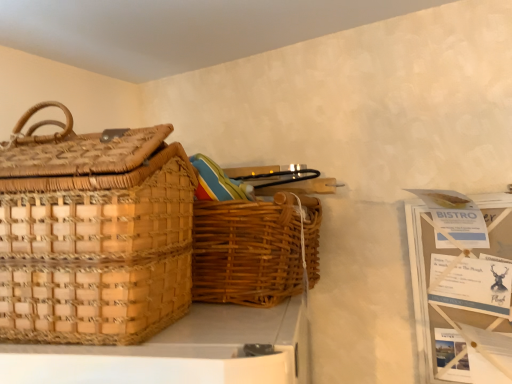
Question: Which direction should I rotate to face woven brown picnic basket at center, arranged as the 2th picnic basket when viewed from the left, — up or down?

Choices:
 (A) down
 (B) up

Answer: (A)

Question: Could you tell me if woven brown picnic basket at center, arranged as the 2th picnic basket when viewed from the left, is turned towards woven natural picnic basket at left, which is the 1th picnic basket from left to right?

Choices:
 (A) no
 (B) yes

Answer: (B)

Question: Does woven brown picnic basket at center, marked as the 1th picnic basket in a right-to-left arrangement, have a smaller size compared to woven natural picnic basket at left, which is the 1th picnic basket from left to right?

Choices:
 (A) yes
 (B) no

Answer: (A)

Question: Does woven brown picnic basket at center, marked as the 1th picnic basket in a right-to-left arrangement, lie in front of woven natural picnic basket at left, the second picnic basket when ordered from right to left?

Choices:
 (A) yes
 (B) no

Answer: (B)

Question: Can you see woven brown picnic basket at center, marked as the 1th picnic basket in a right-to-left arrangement, touching woven natural picnic basket at left, the second picnic basket when ordered from right to left?

Choices:
 (A) no
 (B) yes

Answer: (A)

Question: From the image's perspective, would you say woven brown picnic basket at center, marked as the 1th picnic basket in a right-to-left arrangement, is positioned over woven natural picnic basket at left, the second picnic basket when ordered from right to left?

Choices:
 (A) yes
 (B) no

Answer: (B)

Question: Is woven brown picnic basket at center, arranged as the 2th picnic basket when viewed from the left, positioned behind woven natural picnic basket at left, which is the 1th picnic basket from left to right?

Choices:
 (A) yes
 (B) no

Answer: (A)

Question: From a real-world perspective, is woven natural picnic basket at left, which is the 1th picnic basket from left to right, positioned over woven brown picnic basket at center, marked as the 1th picnic basket in a right-to-left arrangement, based on gravity?

Choices:
 (A) yes
 (B) no

Answer: (A)

Question: Could you tell me if woven natural picnic basket at left, the second picnic basket when ordered from right to left, is facing woven brown picnic basket at center, marked as the 1th picnic basket in a right-to-left arrangement?

Choices:
 (A) no
 (B) yes

Answer: (A)

Question: Can you confirm if woven natural picnic basket at left, which is the 1th picnic basket from left to right, is positioned to the right of woven brown picnic basket at center, marked as the 1th picnic basket in a right-to-left arrangement?

Choices:
 (A) no
 (B) yes

Answer: (A)

Question: Does woven natural picnic basket at left, the second picnic basket when ordered from right to left, have a greater height compared to woven brown picnic basket at center, marked as the 1th picnic basket in a right-to-left arrangement?

Choices:
 (A) yes
 (B) no

Answer: (A)

Question: From a real-world perspective, is woven natural picnic basket at left, the second picnic basket when ordered from right to left, under woven brown picnic basket at center, marked as the 1th picnic basket in a right-to-left arrangement?

Choices:
 (A) no
 (B) yes

Answer: (A)

Question: Does woven natural picnic basket at left, which is the 1th picnic basket from left to right, lie in front of woven brown picnic basket at center, arranged as the 2th picnic basket when viewed from the left?

Choices:
 (A) yes
 (B) no

Answer: (A)

Question: Relative to woven natural picnic basket at left, the second picnic basket when ordered from right to left, is woven brown picnic basket at center, marked as the 1th picnic basket in a right-to-left arrangement, in front or behind?

Choices:
 (A) behind
 (B) front

Answer: (A)